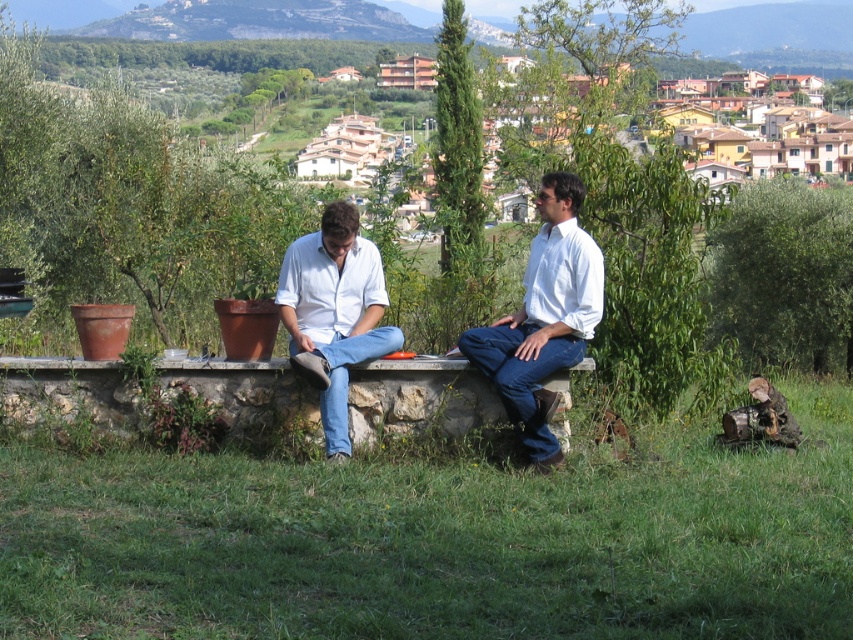
Question: Which point is farther from the camera taking this photo?

Choices:
 (A) (245, 381)
 (B) (534, 284)
 (C) (828, 196)
 (D) (320, 301)

Answer: (C)

Question: Can you confirm if green leafy tree at right is smaller than matte white shirt at center?

Choices:
 (A) no
 (B) yes

Answer: (A)

Question: Which point appears closest to the camera in this image?

Choices:
 (A) (320, 228)
 (B) (712, 323)

Answer: (A)

Question: Is smooth stone ledge at center positioned behind white smooth shirt at center?

Choices:
 (A) yes
 (B) no

Answer: (A)

Question: Which is nearer to the white cotton shirt at center?

Choices:
 (A) smooth stone ledge at center
 (B) matte white shirt at center

Answer: (B)

Question: Where is green leafy tree at right located in relation to white cotton shirt at center in the image?

Choices:
 (A) right
 (B) left

Answer: (A)